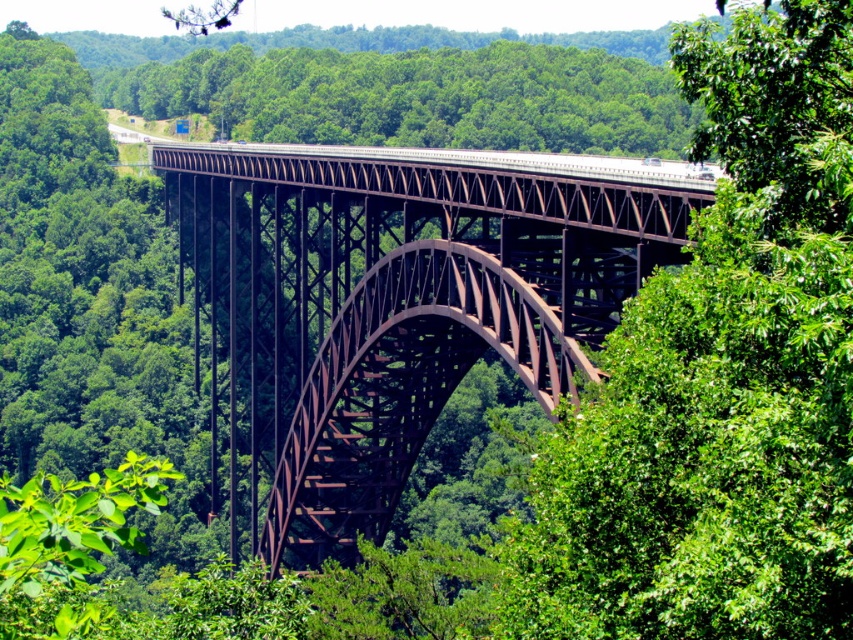
Question: Which of the following is the farthest from the observer?

Choices:
 (A) green leafy tree at center
 (B) rusty metal arch bridge at center

Answer: (B)

Question: Does green leafy tree at center appear over rusty metal arch bridge at center?

Choices:
 (A) no
 (B) yes

Answer: (A)

Question: Observing the image, what is the correct spatial positioning of green leafy tree at center in reference to rusty metal arch bridge at center?

Choices:
 (A) left
 (B) right

Answer: (B)

Question: Which of the following is the closest to the observer?

Choices:
 (A) green leafy tree at center
 (B) rusty metal arch bridge at center

Answer: (A)

Question: Is green leafy tree at center smaller than rusty metal arch bridge at center?

Choices:
 (A) yes
 (B) no

Answer: (A)

Question: Which point is farther from the camera taking this photo?

Choices:
 (A) (666, 577)
 (B) (368, 380)

Answer: (B)